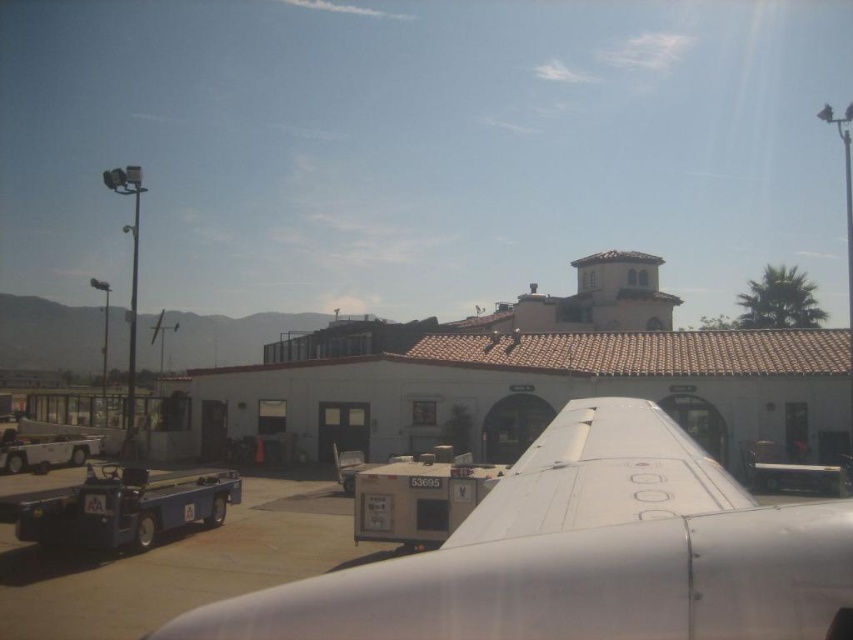
Question: Can you confirm if white matte airplane wing at center is bigger than smooth gray tarmac at lower left?

Choices:
 (A) no
 (B) yes

Answer: (B)

Question: Which object appears farthest from the camera in this image?

Choices:
 (A) smooth gray tarmac at lower left
 (B) white matte airplane wing at center

Answer: (A)

Question: Does white matte airplane wing at center have a lesser width compared to smooth gray tarmac at lower left?

Choices:
 (A) yes
 (B) no

Answer: (B)

Question: Can you confirm if white matte airplane wing at center is thinner than smooth gray tarmac at lower left?

Choices:
 (A) no
 (B) yes

Answer: (A)

Question: Which point is closer to the camera?

Choices:
 (A) (328, 520)
 (B) (724, 612)

Answer: (B)